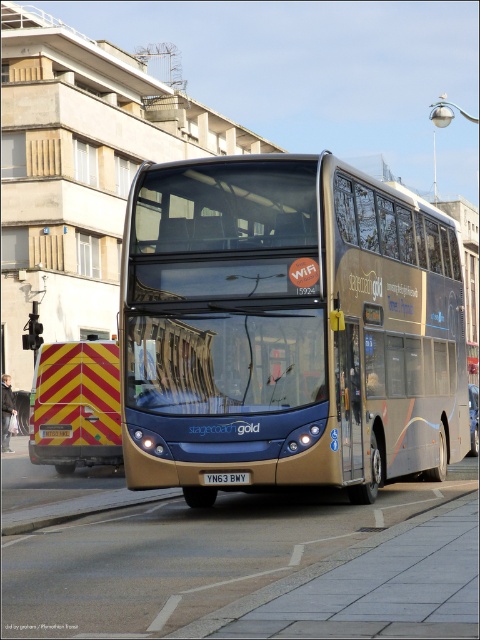
Question: Can you confirm if yellow/red striped reflector at rear is wider than white plastic license plate at center?

Choices:
 (A) no
 (B) yes

Answer: (B)

Question: Among these points, which one is nearest to the camera?

Choices:
 (A) (84, 420)
 (B) (360, 252)
 (C) (228, 477)

Answer: (C)

Question: In this image, where is yellow/red striped reflector at rear located relative to white plastic license plate at center?

Choices:
 (A) below
 (B) above

Answer: (A)

Question: Does gold metallic bus at center have a greater width compared to white plastic license plate at center?

Choices:
 (A) no
 (B) yes

Answer: (A)

Question: Which object appears farthest from the camera in this image?

Choices:
 (A) white plastic license plate at center
 (B) gold metallic bus at center
 (C) yellow/red striped reflector at rear

Answer: (C)

Question: Estimate the real-world distances between objects in this image. Which object is closer to the gold metallic bus at center?

Choices:
 (A) yellow/red striped reflector at rear
 (B) white plastic license plate at center

Answer: (B)